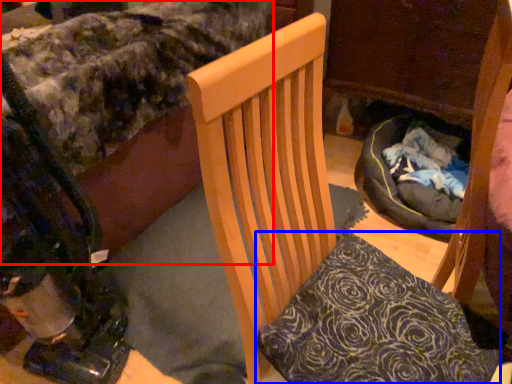
Question: Which object appears closest to the camera in this image, bed (highlighted by a red box) or pillow (highlighted by a blue box)?

Choices:
 (A) bed
 (B) pillow

Answer: (B)